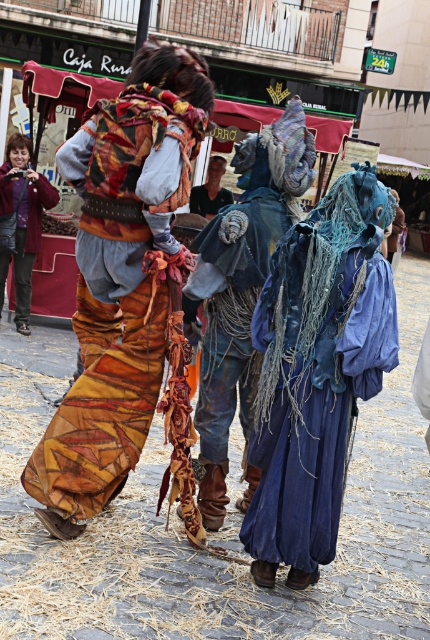
Question: Does blue textured fabric at center appear on the right side of blue fabric at center?

Choices:
 (A) no
 (B) yes

Answer: (A)

Question: Which object appears farthest from the camera in this image?

Choices:
 (A) velvet-like fabric glove at center
 (B) matte purple jacket at left
 (C) blue fabric at center

Answer: (A)

Question: Which point is farther to the camera?

Choices:
 (A) (221, 204)
 (B) (108, 426)

Answer: (A)

Question: Which point is farther to the camera?

Choices:
 (A) (153, 330)
 (B) (202, 396)
 (C) (396, 244)

Answer: (C)

Question: Can you confirm if textured brown fabric at center is wider than blue textured fabric at center?

Choices:
 (A) no
 (B) yes

Answer: (B)

Question: Where is textured brown fabric at center located in relation to blue textured fabric at center in the image?

Choices:
 (A) left
 (B) right

Answer: (A)